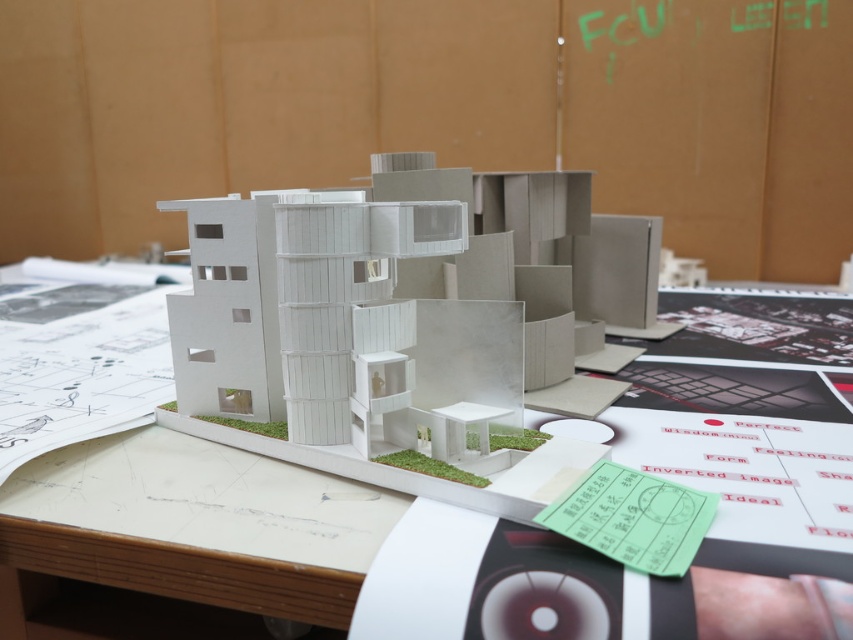
Question: Does white cardboard building at center have a larger size compared to white paper at center?

Choices:
 (A) yes
 (B) no

Answer: (A)

Question: Among these objects, which one is nearest to the camera?

Choices:
 (A) white paper at center
 (B) white cardboard building at center

Answer: (A)

Question: Does white cardboard building at center appear under white paper at center?

Choices:
 (A) yes
 (B) no

Answer: (B)

Question: Considering the relative positions of white cardboard building at center and white paper at center in the image provided, where is white cardboard building at center located with respect to white paper at center?

Choices:
 (A) below
 (B) above

Answer: (B)